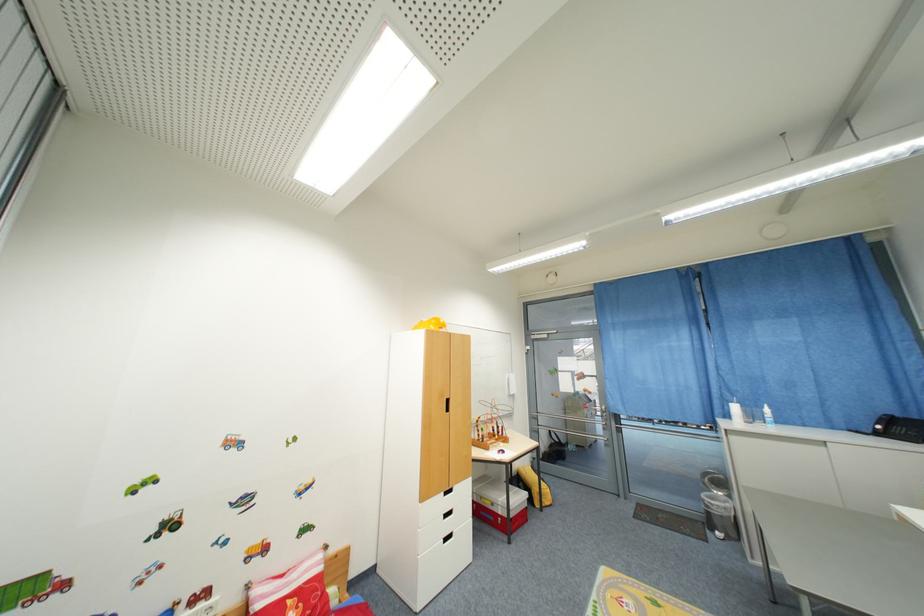
The image size is (924, 616). Identify the location of black cabinet handle. (446, 405).